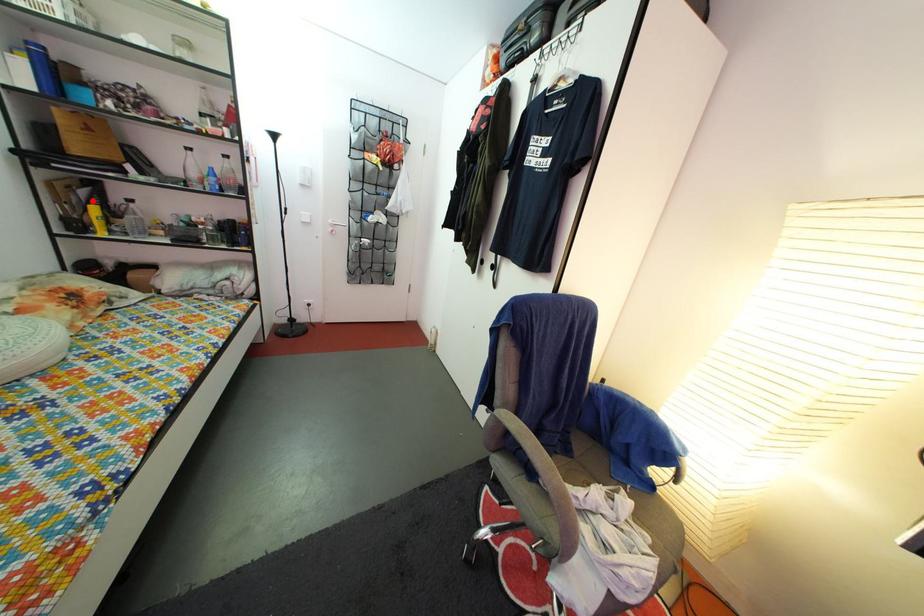
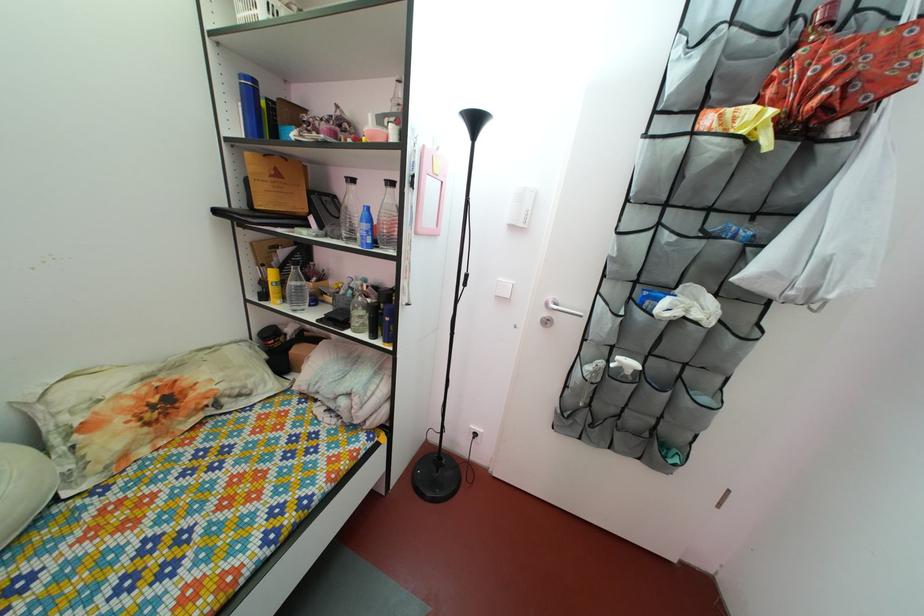
Question: I am providing you with two images of the same scene from different viewpoints. A red point is shown in image1. For the corresponding object point in image2, is it positioned nearer or farther from the camera?

Choices:
 (A) Nearer
 (B) Farther

Answer: (A)